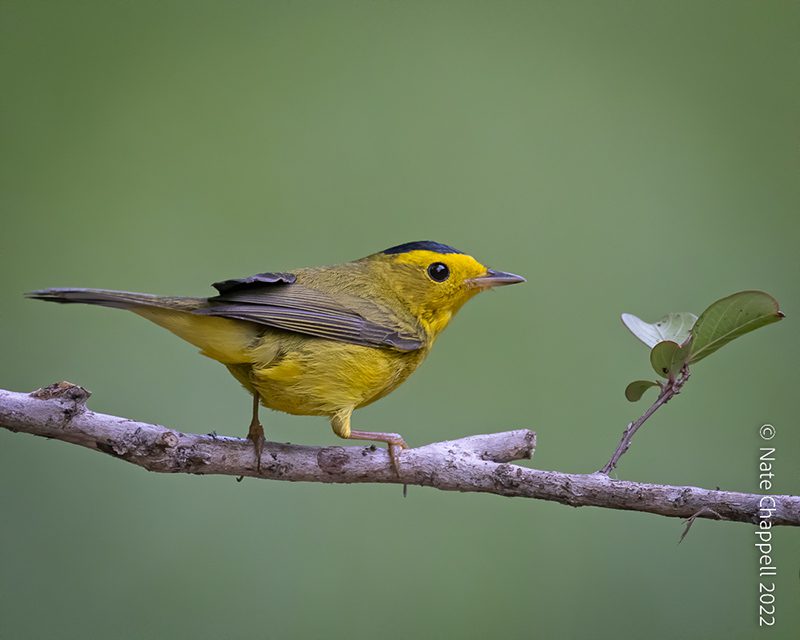
Find the location of a particular element. chest is located at coordinates (397, 365).